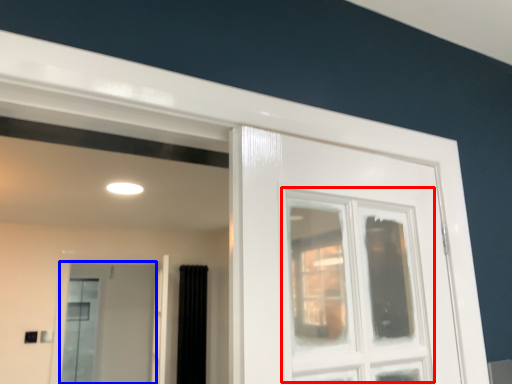
Question: Which of the following is the closest to the observer, window (highlighted by a red box) or screen door (highlighted by a blue box)?

Choices:
 (A) window
 (B) screen door

Answer: (A)